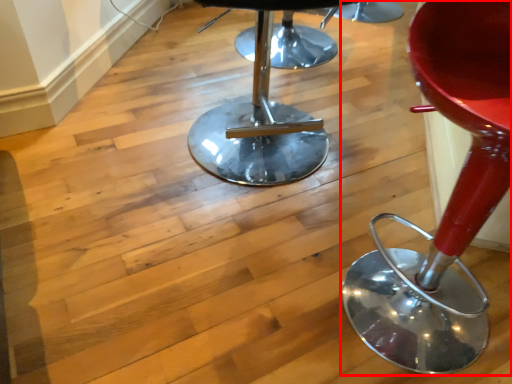
Question: Observing the image, what is the correct spatial positioning of chair (annotated by the red box) in reference to stool?

Choices:
 (A) left
 (B) right

Answer: (B)